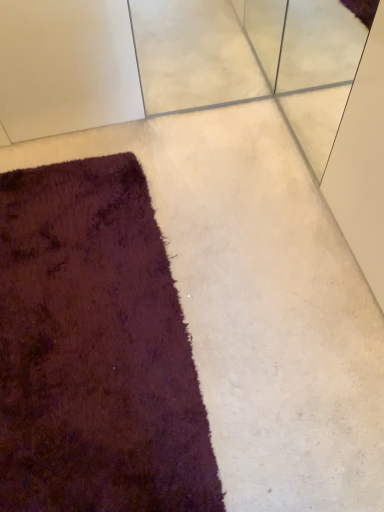
Question: Does white textured concrete at upper center appear on the left side of shaggy dark purple rug at lower left?

Choices:
 (A) yes
 (B) no

Answer: (B)

Question: From the image's perspective, is white textured concrete at upper center above shaggy dark purple rug at lower left?

Choices:
 (A) no
 (B) yes

Answer: (B)

Question: Is white textured concrete at upper center bigger than shaggy dark purple rug at lower left?

Choices:
 (A) no
 (B) yes

Answer: (A)

Question: Does white textured concrete at upper center contain shaggy dark purple rug at lower left?

Choices:
 (A) yes
 (B) no

Answer: (B)

Question: From the image's perspective, is white textured concrete at upper center located beneath shaggy dark purple rug at lower left?

Choices:
 (A) yes
 (B) no

Answer: (B)

Question: Does white textured concrete at upper center have a lesser height compared to shaggy dark purple rug at lower left?

Choices:
 (A) no
 (B) yes

Answer: (A)

Question: From the image's perspective, would you say shaggy dark purple rug at lower left is shown under white textured concrete at upper center?

Choices:
 (A) yes
 (B) no

Answer: (A)

Question: Does shaggy dark purple rug at lower left have a greater width compared to white textured concrete at upper center?

Choices:
 (A) yes
 (B) no

Answer: (A)

Question: Could you tell me if shaggy dark purple rug at lower left is facing white textured concrete at upper center?

Choices:
 (A) no
 (B) yes

Answer: (A)

Question: Is shaggy dark purple rug at lower left bigger than white textured concrete at upper center?

Choices:
 (A) yes
 (B) no

Answer: (A)

Question: Is shaggy dark purple rug at lower left positioned with its back to white textured concrete at upper center?

Choices:
 (A) no
 (B) yes

Answer: (A)

Question: Does shaggy dark purple rug at lower left appear on the right side of white textured concrete at upper center?

Choices:
 (A) no
 (B) yes

Answer: (A)

Question: In the image, is white textured concrete at upper center on the left side or the right side of shaggy dark purple rug at lower left?

Choices:
 (A) left
 (B) right

Answer: (B)